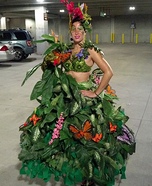
Locate an element on the screen. The image size is (152, 186). concrete pillar is located at coordinates (40, 27).